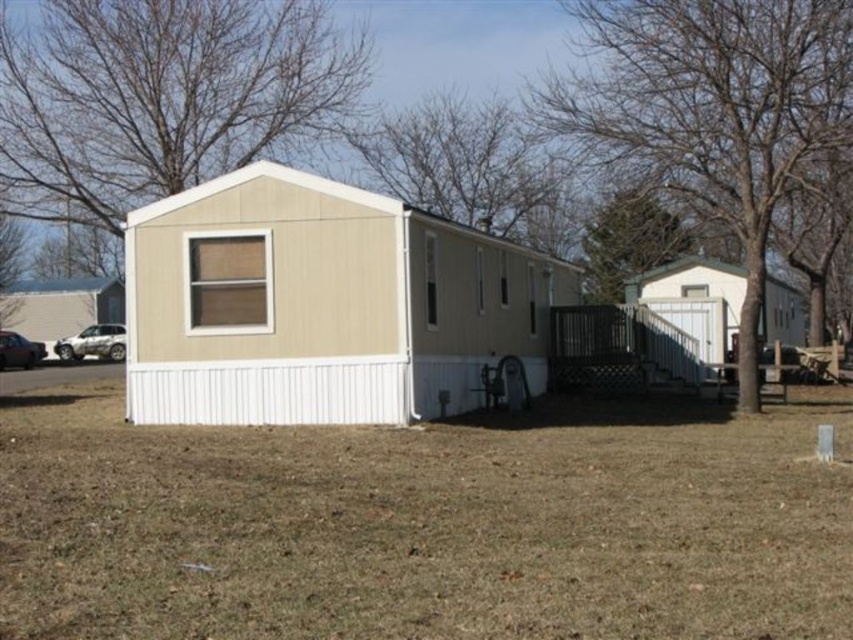
Question: In this image, where is green leafy tree at upper center located relative to silver metallic suv at left?

Choices:
 (A) right
 (B) left

Answer: (A)

Question: Which point is closer to the camera?

Choices:
 (A) (672, 248)
 (B) (369, 547)
 (C) (262, 285)

Answer: (B)

Question: Based on their relative distances, which object is farther from the beige wood tree at upper left?

Choices:
 (A) brown leafless tree at center
 (B) brown textured tree at upper center
 (C) beige siding mobile home at center

Answer: (A)

Question: Can you confirm if brown grass at lower center is thinner than brown leafless tree at center?

Choices:
 (A) yes
 (B) no

Answer: (B)

Question: Is brown grass at lower center wider than brown textured tree at upper center?

Choices:
 (A) no
 (B) yes

Answer: (B)

Question: Which point is closer to the camera?

Choices:
 (A) brown grass at lower center
 (B) beige wood tree at upper left
 (C) green leafy tree at upper center
 (D) brown textured tree at upper center

Answer: (A)